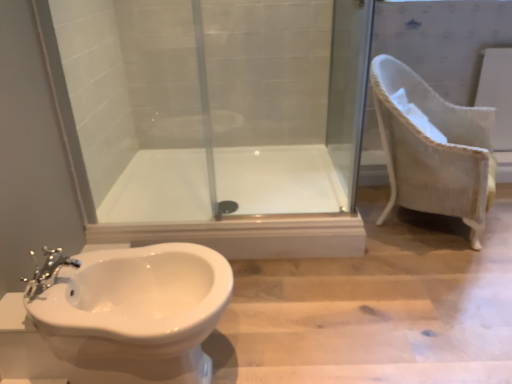
Question: Relative to white glossy toilet at lower left, is white woven armchair at right in front or behind?

Choices:
 (A) front
 (B) behind

Answer: (B)

Question: Is white woven armchair at right taller or shorter than white glossy toilet at lower left?

Choices:
 (A) tall
 (B) short

Answer: (A)

Question: Estimate the real-world distances between objects in this image. Which object is closer to the transparent glass screen door at center?

Choices:
 (A) white woven armchair at right
 (B) white glossy toilet at lower left
 (C) chrome metallic faucet at lower left
 (D) white glossy bath at center

Answer: (A)

Question: Which of these objects is positioned closest to the transparent glass screen door at center?

Choices:
 (A) white glossy bath at center
 (B) white glossy toilet at lower left
 (C) chrome metallic faucet at lower left
 (D) white woven armchair at right

Answer: (D)